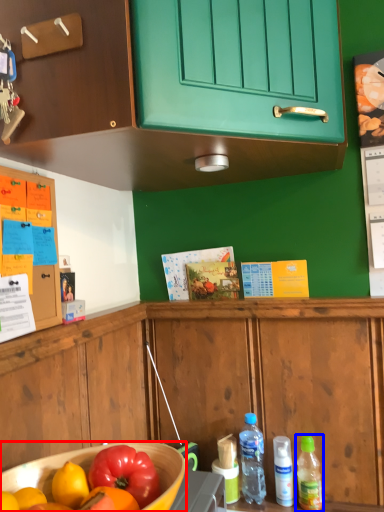
Question: Which object appears closest to the camera in this image, bowl (highlighted by a red box) or bottle (highlighted by a blue box)?

Choices:
 (A) bowl
 (B) bottle

Answer: (A)